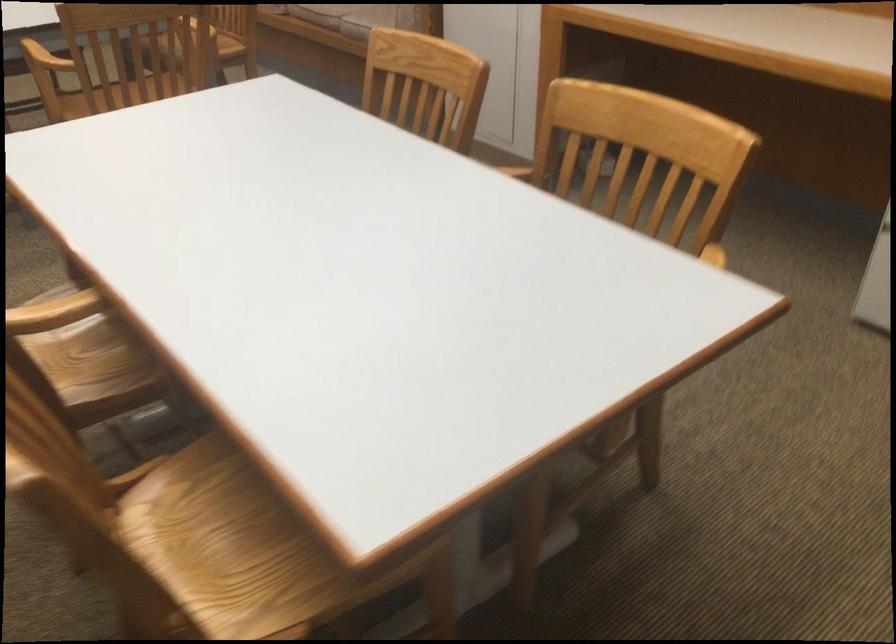
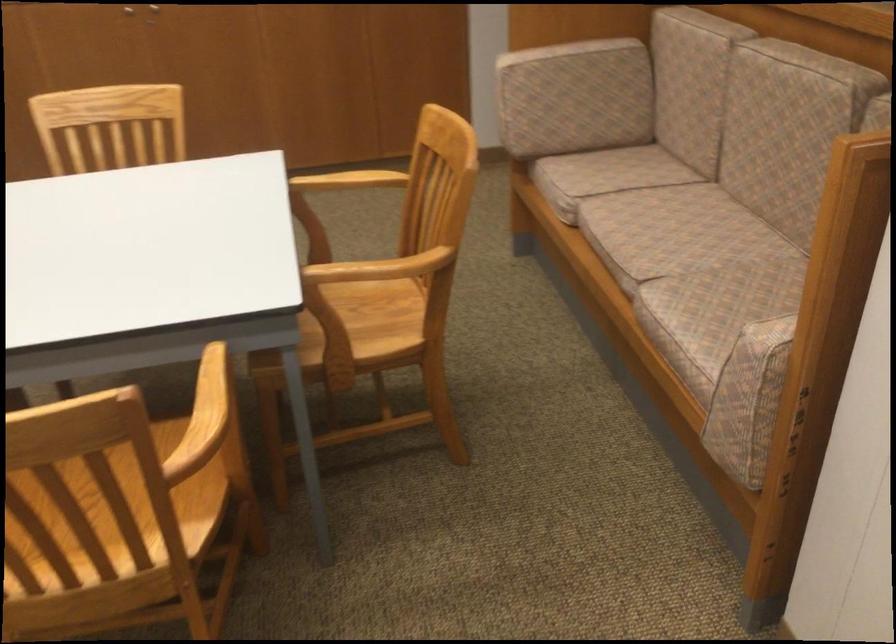
Question: What movement of the cameraman would produce the second image?

Choices:
 (A) Left
 (B) Right
 (C) Forward
 (D) Backward

Answer: (C)